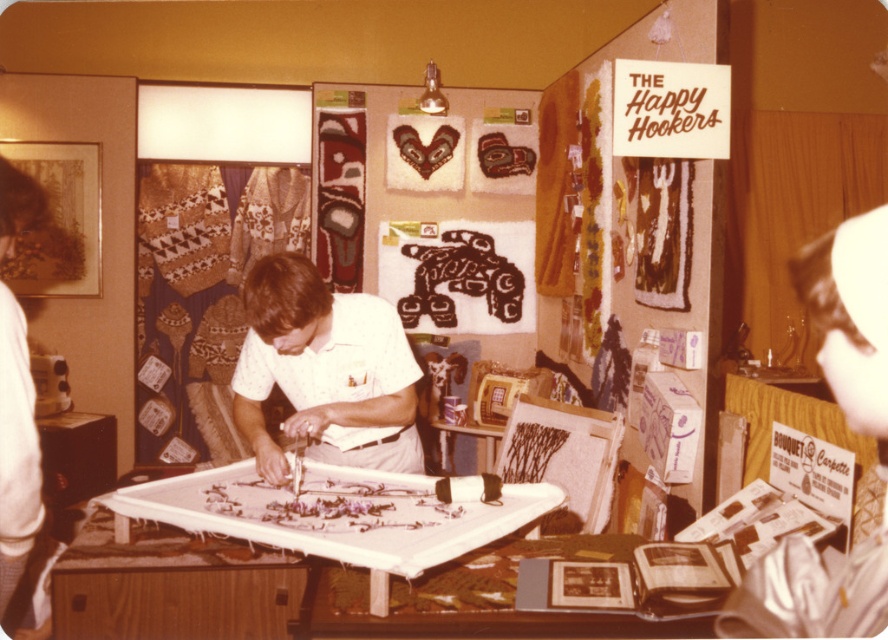
Which is behind, point (314, 292) or point (33, 470)?

Positioned behind is point (314, 292).

Is point (266, 460) positioned behind point (28, 577)?

Yes, point (266, 460) is farther from viewer.

Identify the location of white cotton shirt at center. (324, 371).

Between white cotton pants at lower left and brown woven rug at center, which one appears on the right side from the viewer's perspective?

brown woven rug at center is more to the right.

Find the location of a particular element. The image size is (888, 640). white cotton pants at lower left is located at coordinates (16, 465).

Does white cotton shirt at center appear on the left side of brown woven rug at center?

Indeed, white cotton shirt at center is positioned on the left side of brown woven rug at center.

Does point (402, 364) come closer to viewer compared to point (482, 275)?

That is True.

Does point (405, 337) lie in front of point (485, 296)?

Yes.

Locate an element on the screen. The height and width of the screenshot is (640, 888). white cotton shirt at center is located at coordinates (324, 371).